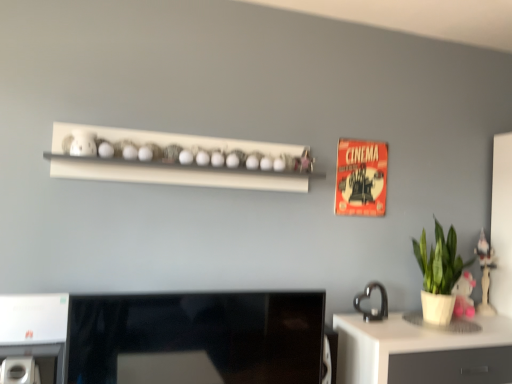
Question: From the image's perspective, is wooden figurine at right located above white glossy desk at lower right?

Choices:
 (A) no
 (B) yes

Answer: (B)

Question: Considering the relative positions of wooden figurine at right and white glossy desk at lower right in the image provided, is wooden figurine at right to the right of white glossy desk at lower right from the viewer's perspective?

Choices:
 (A) no
 (B) yes

Answer: (B)

Question: Is wooden figurine at right wider than white glossy desk at lower right?

Choices:
 (A) no
 (B) yes

Answer: (A)

Question: Can you confirm if wooden figurine at right is smaller than white glossy desk at lower right?

Choices:
 (A) yes
 (B) no

Answer: (A)

Question: Is wooden figurine at right positioned in front of white glossy desk at lower right?

Choices:
 (A) yes
 (B) no

Answer: (B)

Question: From a real-world perspective, relative to white plastic air conditioner at lower left, marked as the 2th appliance in a right-to-left arrangement, is wooden figurine at right vertically above or below?

Choices:
 (A) above
 (B) below

Answer: (A)

Question: Considering their positions, is wooden figurine at right located in front of or behind white plastic air conditioner at lower left, which is the 2th appliance from back to front?

Choices:
 (A) front
 (B) behind

Answer: (B)

Question: From the image's perspective, is wooden figurine at right positioned above or below white plastic air conditioner at lower left, which is the 1th appliance from front to back?

Choices:
 (A) above
 (B) below

Answer: (A)

Question: Is wooden figurine at right inside or outside of white plastic air conditioner at lower left, which is the 2th appliance from back to front?

Choices:
 (A) inside
 (B) outside

Answer: (B)

Question: From the image's perspective, is black glossy desktop at center above or below white plastic air conditioner at lower left, which is the 1th appliance from front to back?

Choices:
 (A) above
 (B) below

Answer: (A)

Question: From a real-world perspective, is black glossy desktop at center physically located above or below white plastic air conditioner at lower left, marked as the 2th appliance in a right-to-left arrangement?

Choices:
 (A) above
 (B) below

Answer: (A)

Question: Is black glossy desktop at center to the left or to the right of white plastic air conditioner at lower left, which is the 2th appliance from back to front, in the image?

Choices:
 (A) left
 (B) right

Answer: (B)

Question: Looking at the image, does black glossy desktop at center seem bigger or smaller compared to white plastic air conditioner at lower left, the 1th appliance positioned from the left?

Choices:
 (A) big
 (B) small

Answer: (A)

Question: From the image's perspective, is green matte plant at right located above or below white glossy desk at lower right?

Choices:
 (A) above
 (B) below

Answer: (A)

Question: From a real-world perspective, relative to white glossy desk at lower right, is green matte plant at right vertically above or below?

Choices:
 (A) below
 (B) above

Answer: (B)